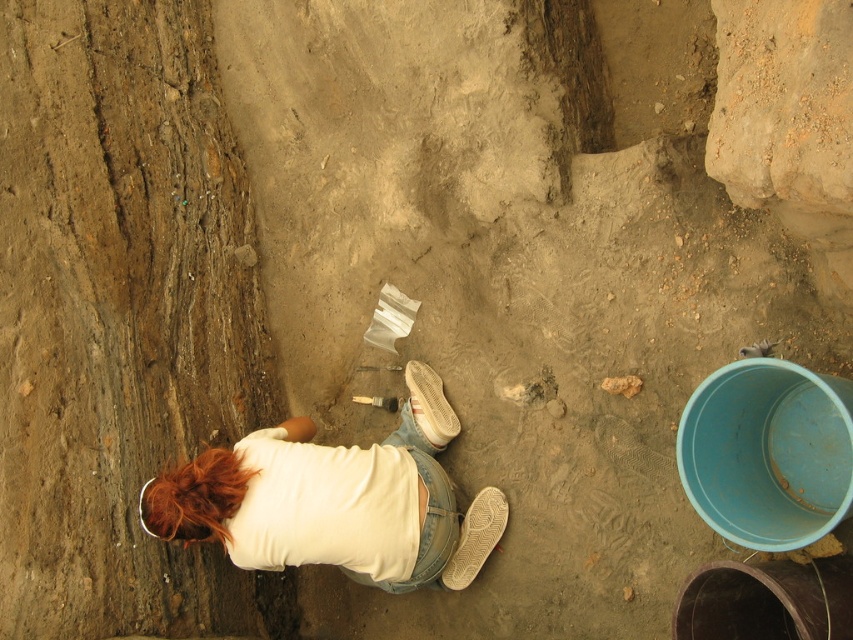
You are an archaeologist looking at the scene. You see the white cotton shirt at center and the white matte shoe at lower center. Which object is positioned closer to you?

The white cotton shirt at center is closer to the viewer than the white matte shoe at lower center.

You are an archaeologist standing at the excavation site. You notice the white cotton shirt at center and the white suede shoe at center. Which object is nearer to you?

The white cotton shirt at center is closer to the viewer than the white suede shoe at center.

You are standing at the point marked as point (x=476, y=538). What object is exactly at this point?

The white matte shoe at lower center is exactly at point (x=476, y=538).